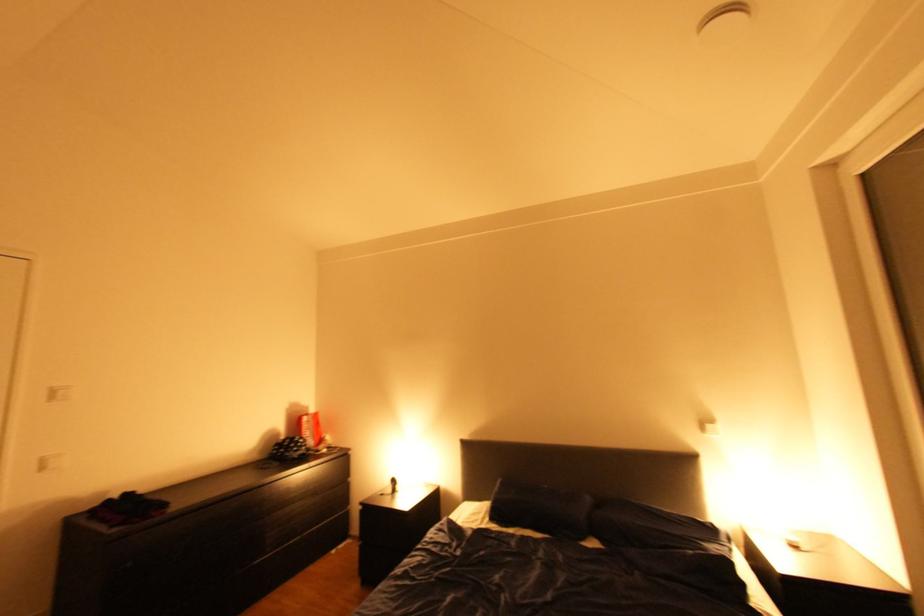
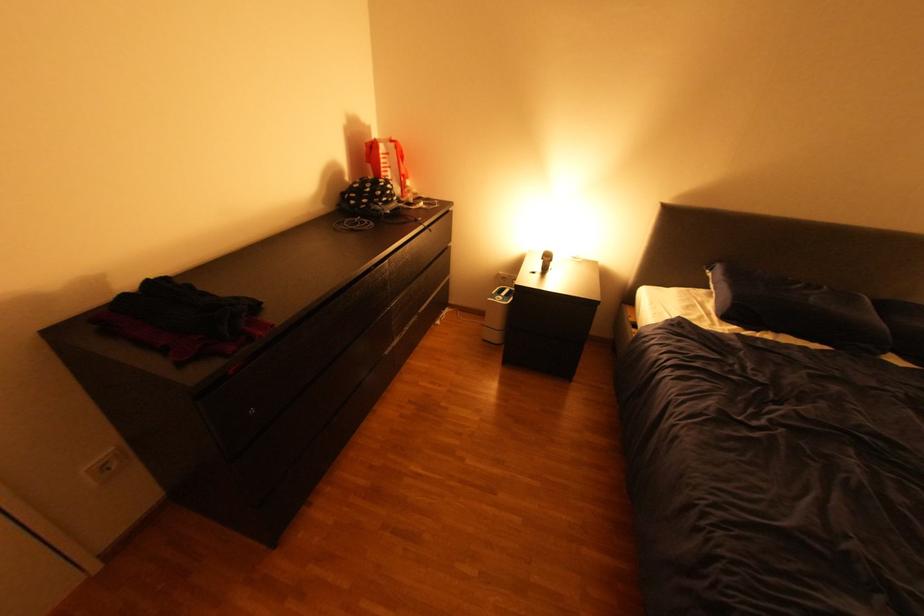
Locate, in the second image, the point that corresponds to point 318,407 in the first image.

(379, 129)